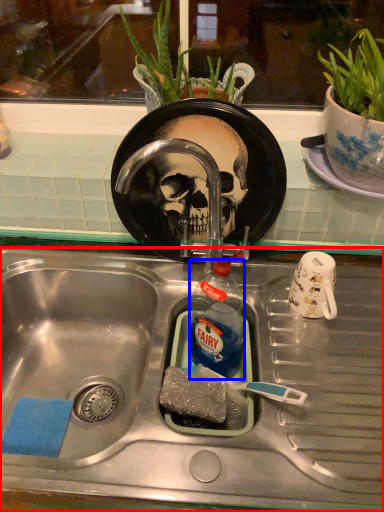
Question: Which point is further to the camera, sink (highlighted by a red box) or bottle (highlighted by a blue box)?

Choices:
 (A) sink
 (B) bottle

Answer: (B)